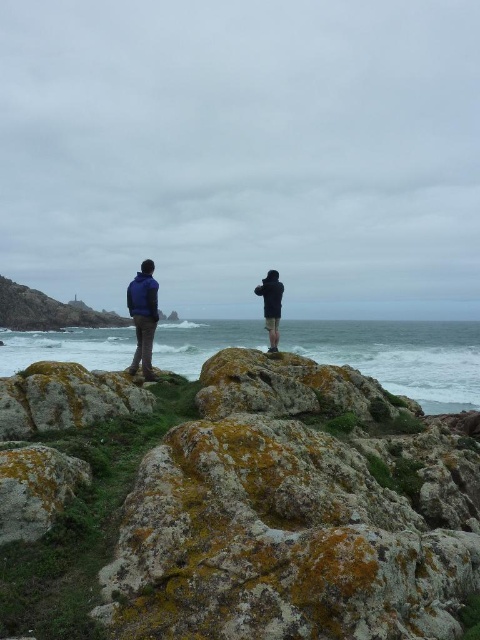
From the picture: Does lichen-covered rock at lower left have a smaller size compared to dark blue jacket at center?

Yes, lichen-covered rock at lower left is smaller than dark blue jacket at center.

What are the coordinates of `lichen-covered rock at lower left` in the screenshot? It's located at point(36,490).

Which is in front, point (6, 534) or point (269, 275)?

Point (6, 534) is more forward.

In order to click on lichen-covered rock at lower left in this screenshot , I will do `click(36, 490)`.

Is green mossy rock at center to the left of matte blue jacket at center from the viewer's perspective?

No, green mossy rock at center is not to the left of matte blue jacket at center.

Is green mossy rock at center shorter than matte blue jacket at center?

Indeed, green mossy rock at center has a lesser height compared to matte blue jacket at center.

Is point (229, 349) farther from viewer compared to point (140, 352)?

No, it is not.

Where is `green mossy rock at center`? green mossy rock at center is located at coordinates (239, 506).

Does white frothy water at center appear on the left side of matte blue jacket at center?

In fact, white frothy water at center is to the right of matte blue jacket at center.

Is point (436, 365) farther from camera compared to point (151, 301)?

That is True.

Locate an element on the screen. This screenshot has height=640, width=480. white frothy water at center is located at coordinates pyautogui.click(x=398, y=355).